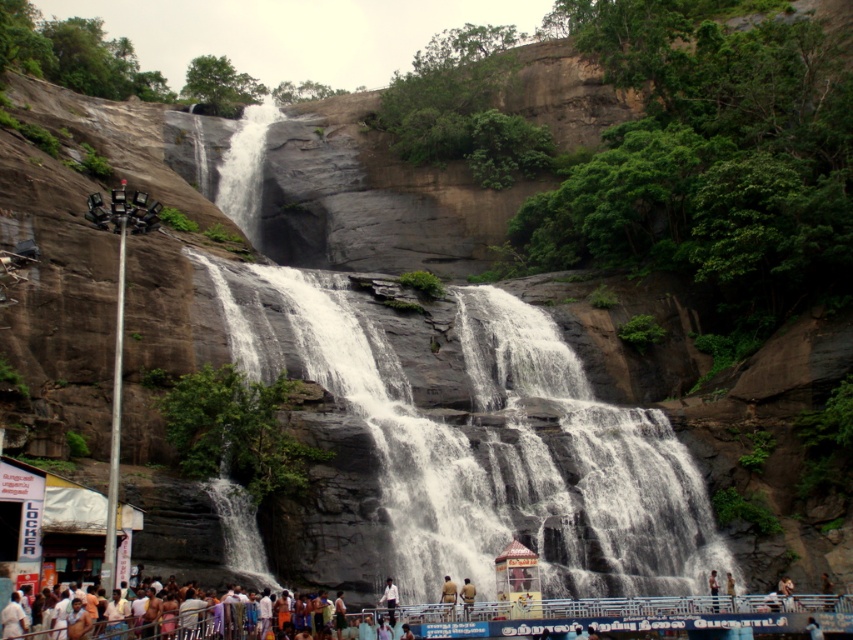
Is light brown skin at center to the right of brown leather jacket at lower center from the viewer's perspective?

No, light brown skin at center is not to the right of brown leather jacket at lower center.

Between light brown skin at center and brown leather jacket at lower center, which one is positioned higher?

light brown skin at center is above.

Locate an element on the screen. light brown skin at center is located at coordinates (448, 598).

Locate an element on the screen. This screenshot has height=640, width=853. light brown skin at center is located at coordinates (448, 598).

Between light brown skin at center and white shirt at lower center, which one appears on the left side from the viewer's perspective?

white shirt at lower center

What do you see at coordinates (448, 598) in the screenshot?
I see `light brown skin at center` at bounding box center [448, 598].

Locate an element on the screen. The image size is (853, 640). light brown skin at center is located at coordinates (448, 598).

Find the location of `light brown skin at center`. light brown skin at center is located at coordinates click(448, 598).

In the scene shown: Does gray stone waterfall at center lie behind white shirt at lower center?

Yes, it is.

Is point (254, 269) less distant than point (384, 600)?

No, (254, 269) is further to viewer.

At what (x,y) coordinates should I click in order to perform the action: click on gray stone waterfall at center. Please return your answer as a coordinate pair (x, y). Image resolution: width=853 pixels, height=640 pixels. Looking at the image, I should click on (486, 440).